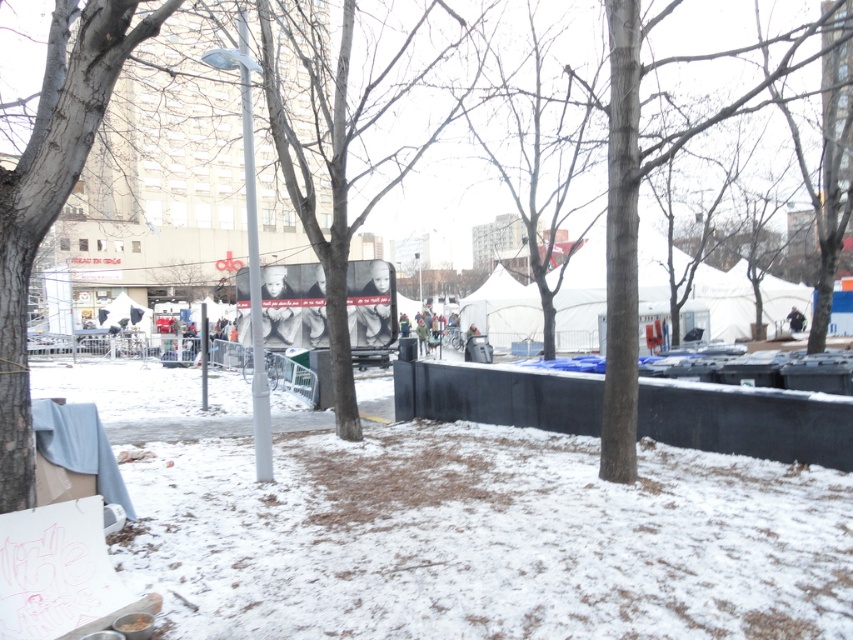
Is point (329, 81) positioned before point (114, 17)?

No, it is not.

Is smooth gray tree at center further to the viewer compared to gray bark tree at left?

Yes, smooth gray tree at center is behind gray bark tree at left.

Identify the location of smooth gray tree at center. Image resolution: width=853 pixels, height=640 pixels. (351, 134).

Identify the location of smooth gray tree at center. (351, 134).